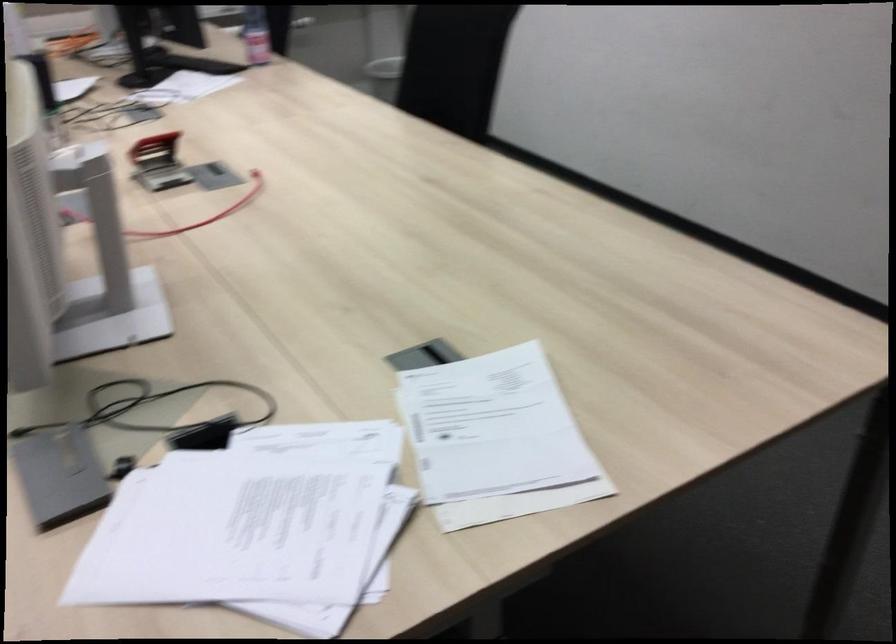
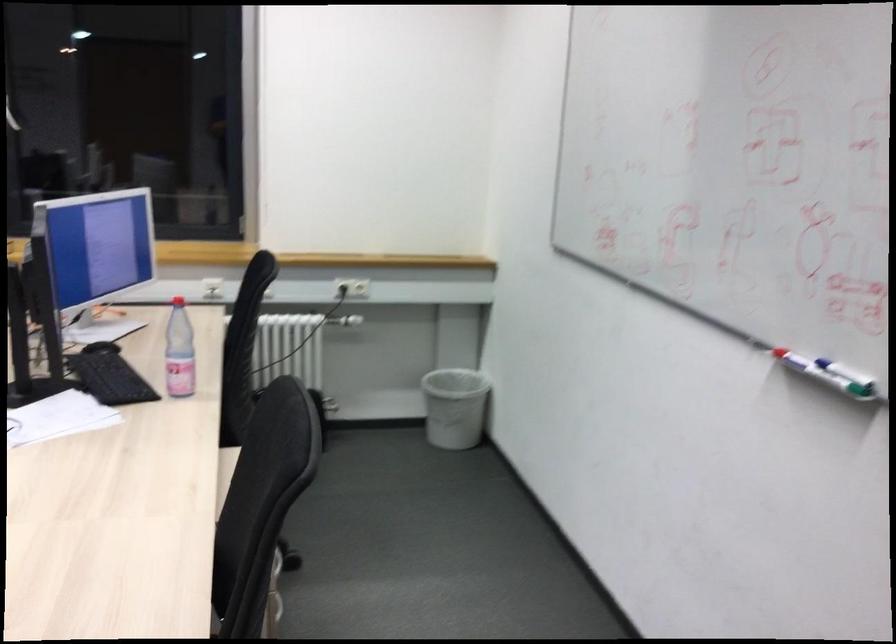
The images are taken continuously from a first-person perspective. In which direction are you moving?

The cameraman moved toward right, forward.